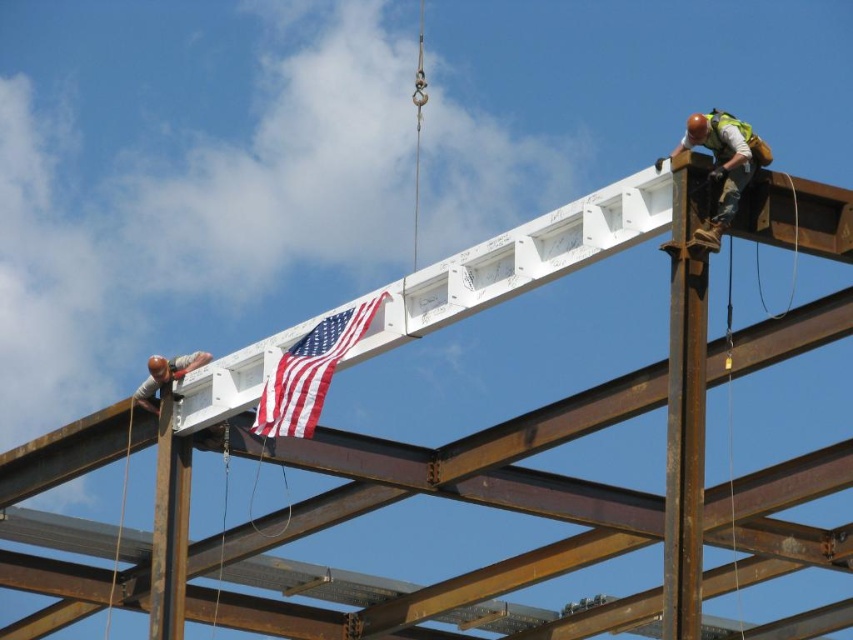
Which is behind, point (682, 259) or point (189, 452)?

Point (189, 452)

Does rusty metal pole at upper right come in front of smooth brown pole at lower left?

Yes, it is in front of smooth brown pole at lower left.

Does point (695, 348) lie behind point (165, 586)?

No, (695, 348) is in front of (165, 586).

This screenshot has height=640, width=853. In order to click on rusty metal pole at upper right in this screenshot , I will do `click(685, 401)`.

Can you confirm if smooth brown pole at lower left is shorter than hard hat steel worker at upper right?

No, smooth brown pole at lower left is not shorter than hard hat steel worker at upper right.

The width and height of the screenshot is (853, 640). What do you see at coordinates (169, 525) in the screenshot?
I see `smooth brown pole at lower left` at bounding box center [169, 525].

I want to click on smooth brown pole at lower left, so click(169, 525).

In the scene shown: Is american flag at center smaller than brushed metal helmet at lower left?

Indeed, american flag at center has a smaller size compared to brushed metal helmet at lower left.

Which is above, american flag at center or brushed metal helmet at lower left?

Positioned higher is american flag at center.

Which is behind, point (274, 369) or point (189, 356)?

The point (189, 356) is more distant.

This screenshot has height=640, width=853. In order to click on american flag at center in this screenshot , I will do pos(310,371).